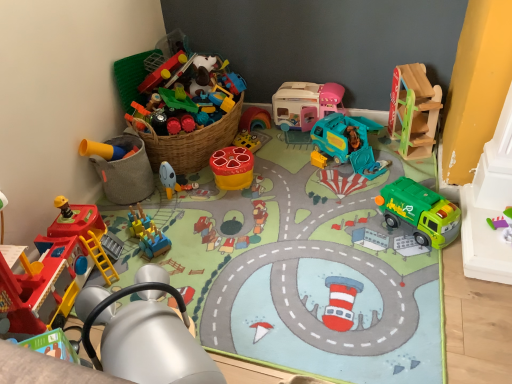
Identify the location of empty space that is in between wooden slide at upper right, marked as the ninth toy in a left-to-right arrangement, and blue plastic train at center, which appears as the 2th toy when viewed from the left. Image resolution: width=512 pixels, height=384 pixels. [x=272, y=196].